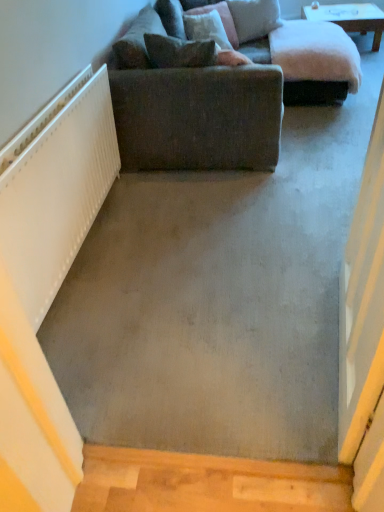
Question: Is brown fabric pillow at upper center, marked as the first pillow in a front-to-back arrangement, surrounding white glossy table at upper center?

Choices:
 (A) no
 (B) yes

Answer: (A)

Question: From a real-world perspective, is brown fabric pillow at upper center, arranged as the fourth pillow when viewed from the back, located higher than white glossy table at upper center?

Choices:
 (A) no
 (B) yes

Answer: (B)

Question: From the image's perspective, is brown fabric pillow at upper center, arranged as the fourth pillow when viewed from the back, over white glossy table at upper center?

Choices:
 (A) no
 (B) yes

Answer: (A)

Question: Considering the relative sizes of brown fabric pillow at upper center, marked as the first pillow in a front-to-back arrangement, and white glossy table at upper center in the image provided, is brown fabric pillow at upper center, marked as the first pillow in a front-to-back arrangement, taller than white glossy table at upper center?

Choices:
 (A) yes
 (B) no

Answer: (B)

Question: Does brown fabric pillow at upper center, arranged as the fourth pillow when viewed from the back, touch white glossy table at upper center?

Choices:
 (A) yes
 (B) no

Answer: (B)

Question: In terms of width, does fluffy pink pillow at upper center, the first pillow when ordered from back to front, look wider or thinner when compared to velvet pink pillow at upper center, arranged as the 3th pillow when viewed from the back?

Choices:
 (A) wide
 (B) thin

Answer: (B)

Question: Is fluffy pink pillow at upper center, arranged as the fourth pillow when viewed from the front, inside the boundaries of velvet pink pillow at upper center, arranged as the 3th pillow when viewed from the back, or outside?

Choices:
 (A) outside
 (B) inside

Answer: (A)

Question: From their relative heights in the image, would you say fluffy pink pillow at upper center, the first pillow when ordered from back to front, is taller or shorter than velvet pink pillow at upper center, positioned as the 2th pillow in front-to-back order?

Choices:
 (A) tall
 (B) short

Answer: (B)

Question: Considering the positions of fluffy pink pillow at upper center, arranged as the fourth pillow when viewed from the front, and velvet pink pillow at upper center, arranged as the 3th pillow when viewed from the back, in the image, is fluffy pink pillow at upper center, arranged as the fourth pillow when viewed from the front, bigger or smaller than velvet pink pillow at upper center, arranged as the 3th pillow when viewed from the back,?

Choices:
 (A) big
 (B) small

Answer: (B)

Question: Considering the relative positions of white glossy table at upper center and velvet brown pillow at upper center, which appears as the 2th pillow when viewed from the back, in the image provided, is white glossy table at upper center to the left or to the right of velvet brown pillow at upper center, which appears as the 2th pillow when viewed from the back,?

Choices:
 (A) left
 (B) right

Answer: (B)

Question: Would you say white glossy table at upper center is inside or outside velvet brown pillow at upper center, which appears as the 2th pillow when viewed from the back?

Choices:
 (A) inside
 (B) outside

Answer: (B)

Question: Is white glossy table at upper center wider or thinner than velvet brown pillow at upper center, which ranks as the 3th pillow in front-to-back order?

Choices:
 (A) thin
 (B) wide

Answer: (B)

Question: From a real-world perspective, relative to velvet brown pillow at upper center, which ranks as the 3th pillow in front-to-back order, is white glossy table at upper center vertically above or below?

Choices:
 (A) above
 (B) below

Answer: (B)

Question: Considering the positions of point (231, 158) and point (216, 54), is point (231, 158) closer or farther from the camera than point (216, 54)?

Choices:
 (A) farther
 (B) closer

Answer: (A)

Question: Is textured gray fabric couch at upper center spatially inside velvet pink pillow at upper center, positioned as the 2th pillow in front-to-back order, or outside of it?

Choices:
 (A) inside
 (B) outside

Answer: (B)